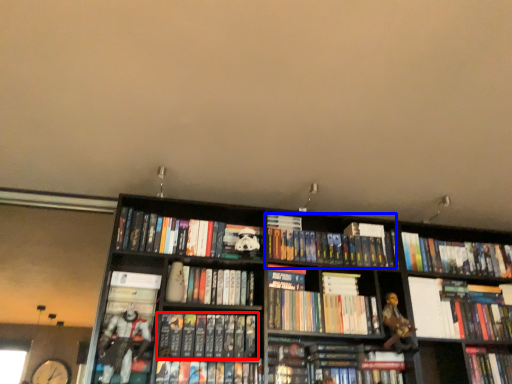
Question: Which point is further to the camera, book (highlighted by a red box) or book (highlighted by a blue box)?

Choices:
 (A) book
 (B) book

Answer: (B)